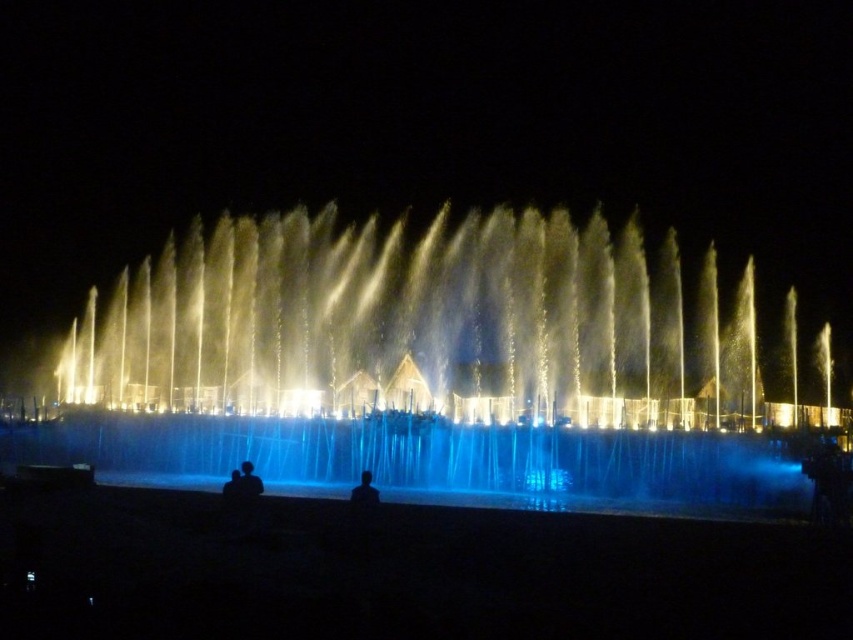
You are standing at the edge of the fountain and want to reach the silhouette skin at lower center without getting wet. The silhouette figure at center is blocking your path. Can you walk around them to reach the skin safely?

The silhouette figure at center is 4.13 feet away from the silhouette skin at lower center. Since the figure is blocking your path, you can walk around them to reach the skin safely as there is enough space between them and the skin.

From the picture: A tourist is standing at the edge of the fountain and wants to take a photo of the silhouette figure at center. Which direction should they move to frame the figure in the center of their camera view?

The silhouette figure at center is already positioned at the center of the scene, so the tourist should not need to move. They can take the photo from their current position.